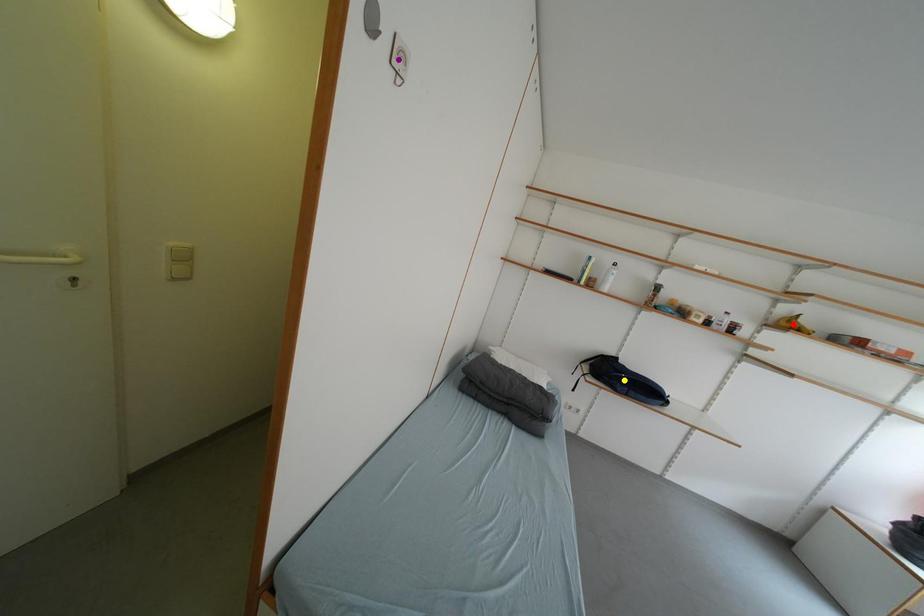
Order these from nearest to farthest:
A) red point
B) purple point
C) yellow point

purple point
red point
yellow point